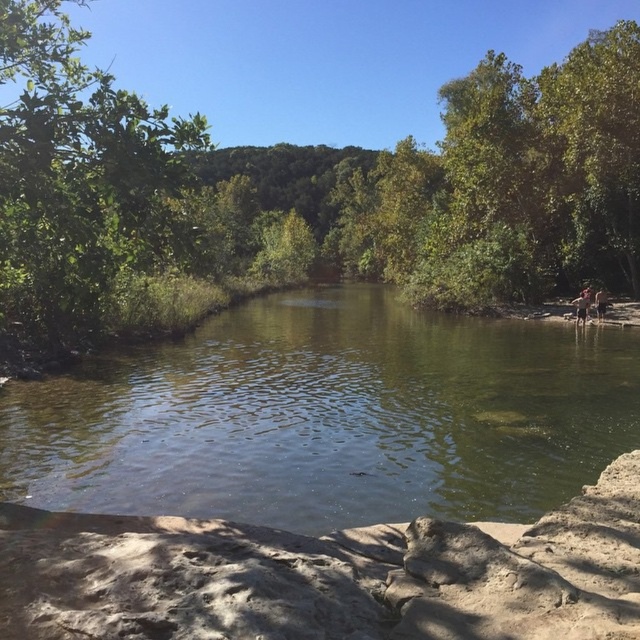
You are standing at the edge of the water and want to take a photo of the green leafy tree at center. Based on your position, where should you aim your camera to capture the tree in the center of the photo?

To capture the green leafy tree at center in the center of the photo, aim your camera at the coordinates point (300, 193) where the tree is located.

You are standing at the edge of the river and see two points in the scene. The first point is at coordinates point (33, 353) and the second is at point (518, 353). Which point is closer to you?

Point (33, 353) is closer to the camera than point (518, 353), so the first point is closer to you.

You are standing on the sandy shoreline and want to reach the green leafy tree at center. The green translucent water at center is between you and the tree. Can you walk directly to the tree without getting your feet wet?

The green leafy tree at center is 35.59 meters away from the green translucent water at center. Since the water is between you and the tree, you would have to walk through the water to reach the tree, so your feet will get wet.